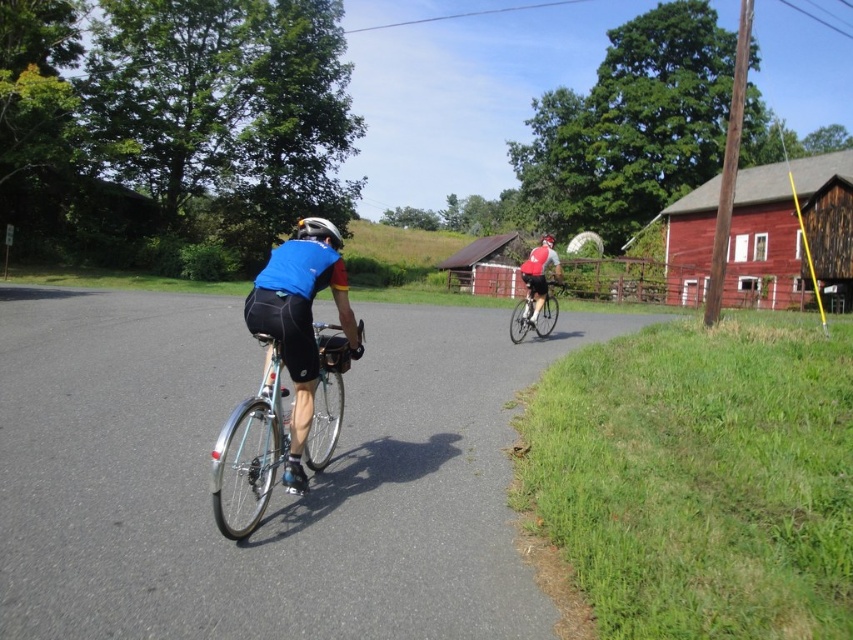
Question: Does shiny silver bicycle at right have a smaller size compared to matte red jersey at center?

Choices:
 (A) no
 (B) yes

Answer: (B)

Question: Which of these objects is positioned closest to the matte blue jersey at center?

Choices:
 (A) shiny silver bicycle at right
 (B) matte white helmet at center

Answer: (A)

Question: Among these points, which one is farthest from the camera?

Choices:
 (A) (534, 300)
 (B) (323, 244)
 (C) (521, 273)
 (D) (299, 237)

Answer: (A)

Question: Among these points, which one is farthest from the camera?

Choices:
 (A) (335, 307)
 (B) (312, 234)
 (C) (541, 273)
 (D) (259, 444)

Answer: (C)

Question: Does shiny silver bicycle at right appear on the left side of matte white helmet at center?

Choices:
 (A) no
 (B) yes

Answer: (B)

Question: Is shiny silver bicycle at right bigger than matte white helmet at center?

Choices:
 (A) yes
 (B) no

Answer: (B)